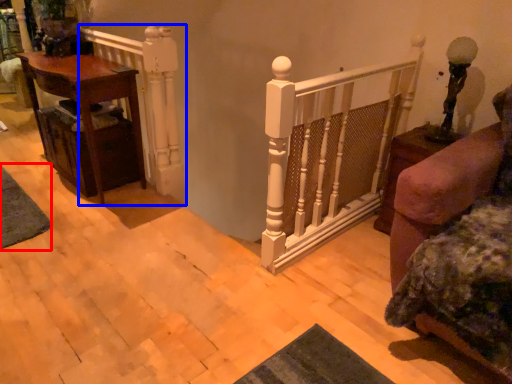
Question: Among these objects, which one is nearest to the camera, mat (highlighted by a red box) or rail (highlighted by a blue box)?

Choices:
 (A) mat
 (B) rail

Answer: (B)